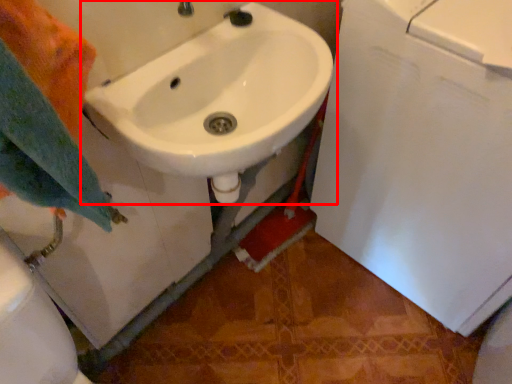
Question: In this image, where is sink (annotated by the red box) located relative to bath towel?

Choices:
 (A) right
 (B) left

Answer: (A)